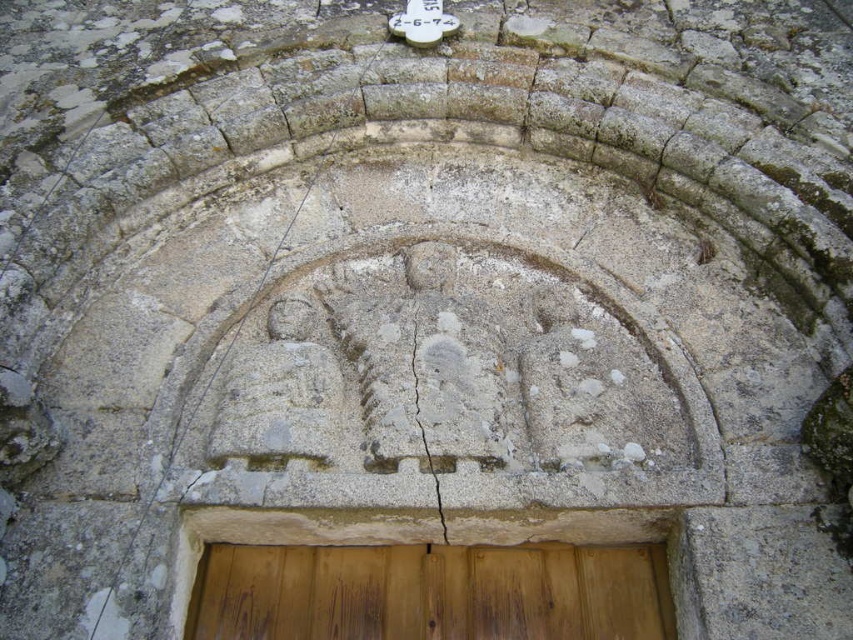
You are standing in front of the stone archway and need to locate the wooden door at center and the cracked stone at center. According to the scene, which object is positioned to the right of the other?

The wooden door at center is to the right of cracked stone at center, so the wooden door at center is positioned to the right of the cracked stone at center.

You are standing in front of the archway and notice the wooden door at center and the cracked stone at center. Which object is located above the other?

The cracked stone at center is above the wooden door at center because the wooden door at center is positioned under cracked stone at center.